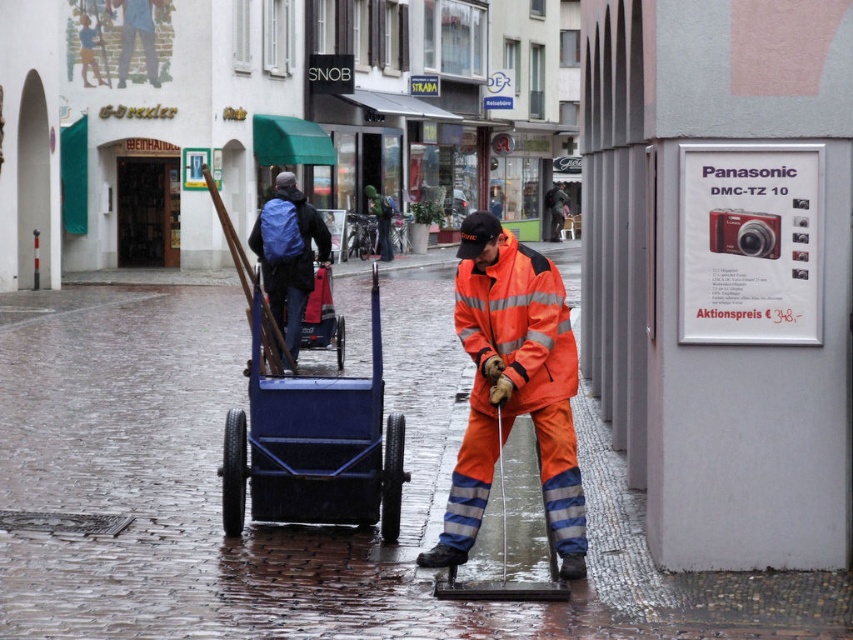
Question: Is wet cobblestone pavement at center closer to camera compared to blue plastic cart at center?

Choices:
 (A) no
 (B) yes

Answer: (B)

Question: Estimate the real-world distances between objects in this image. Which object is farther from the blue backpack at center?

Choices:
 (A) wet cobblestone pavement at center
 (B) orange reflective fabric at center
 (C) blue plastic cart at center

Answer: (B)

Question: Is orange reflective fabric at center above blue backpack at center?

Choices:
 (A) yes
 (B) no

Answer: (B)

Question: Based on their relative distances, which object is farther from the wet cobblestone pavement at center?

Choices:
 (A) blue plastic cart at center
 (B) blue backpack at center
 (C) orange reflective fabric at center

Answer: (A)

Question: Which of these objects is positioned closest to the blue backpack at center?

Choices:
 (A) wet cobblestone pavement at center
 (B) blue plastic cart at center

Answer: (A)

Question: Is orange reflective fabric at center bigger than blue backpack at center?

Choices:
 (A) yes
 (B) no

Answer: (A)